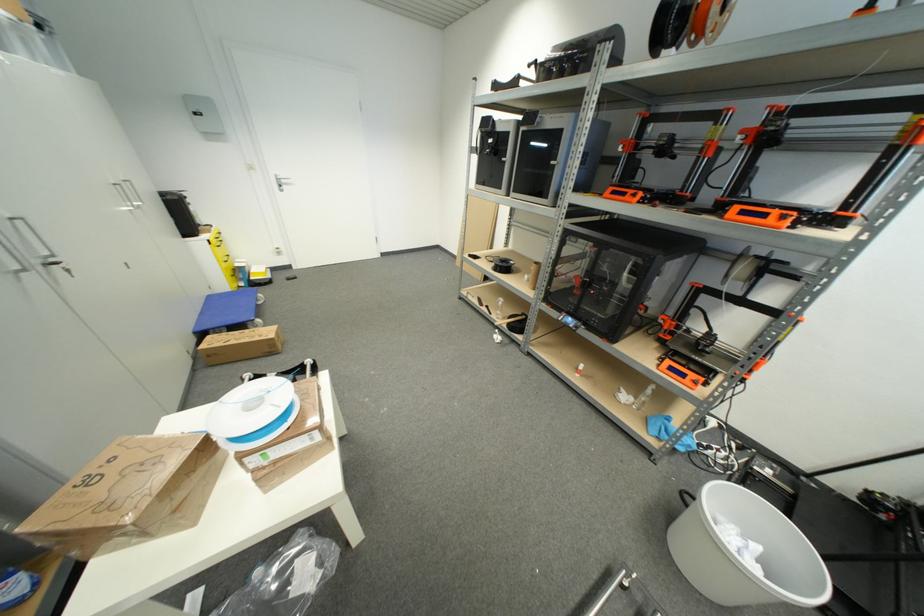
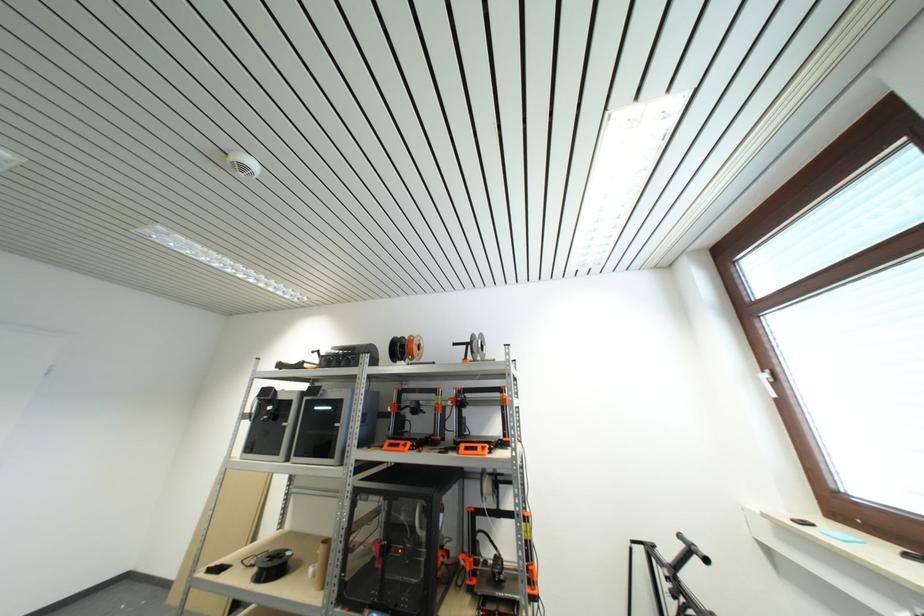
In the second image, find the point that corresponds to point (556, 164) in the first image.

(341, 427)